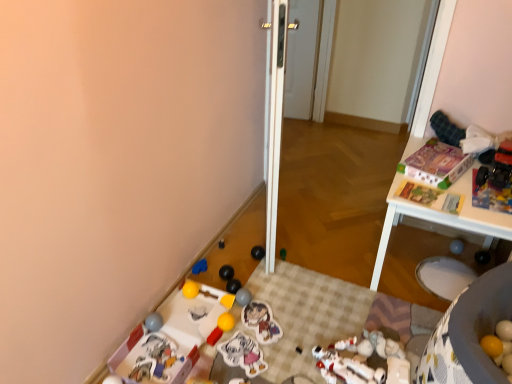
Where is `vacant space situated on the left part of matte gray ball at center, which ranks as the 10th toy in right-to-left order`? vacant space situated on the left part of matte gray ball at center, which ranks as the 10th toy in right-to-left order is located at coordinates (204, 306).